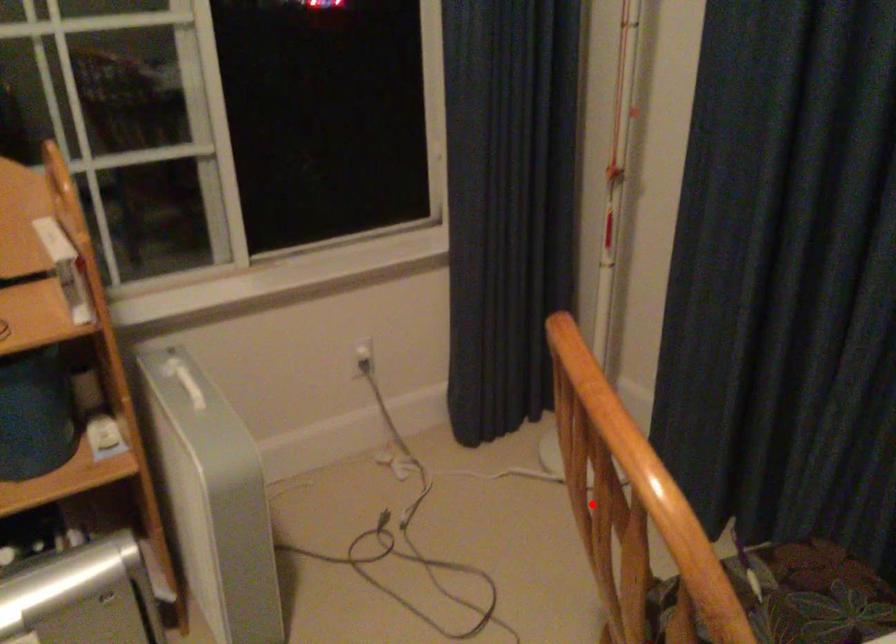
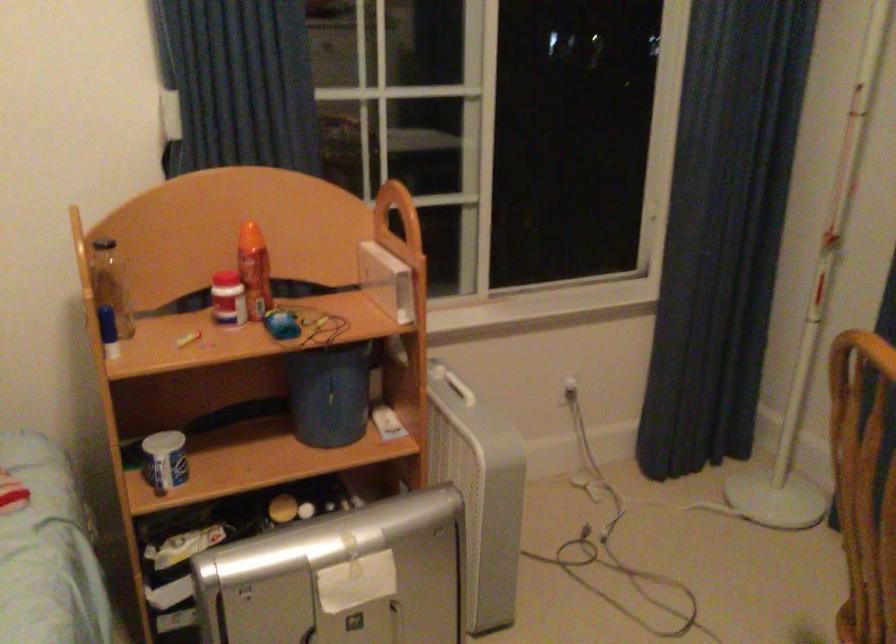
Question: A red point is marked in image1. In image2, is the corresponding 3D point closer to the camera or farther? Reply with the corresponding letter.

Choices:
 (A) The corresponding 3D point is closer.
 (B) The corresponding 3D point is farther.

Answer: (B)